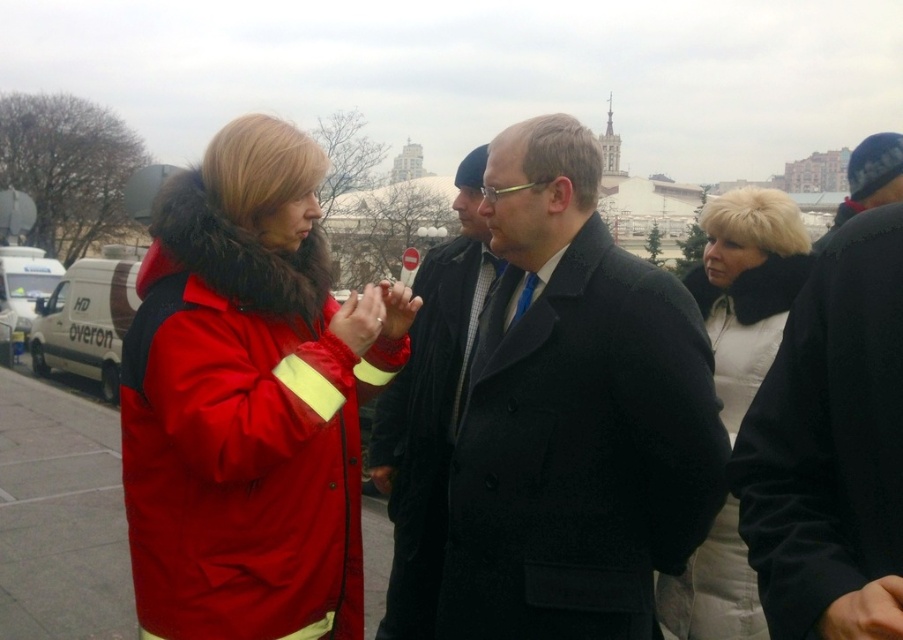
Is the position of matte black coat at center more distant than that of red fabric jacket at left?

No, matte black coat at center is in front of red fabric jacket at left.

How much distance is there between matte black coat at center and red fabric jacket at left?

matte black coat at center and red fabric jacket at left are 40.58 meters apart.

Between point (570, 312) and point (22, 417), which one is positioned behind?

Positioned behind is point (22, 417).

At what (x,y) coordinates should I click in order to perform the action: click on matte black coat at center. Please return your answer as a coordinate pair (x, y). This screenshot has width=903, height=640. Looking at the image, I should click on (574, 413).

Can you confirm if matte black coat at center is positioned to the right of dark gray wool coat at center?

Yes, matte black coat at center is to the right of dark gray wool coat at center.

Is matte black coat at center thinner than dark gray wool coat at center?

No.

This screenshot has width=903, height=640. In order to click on matte black coat at center in this screenshot , I will do `click(574, 413)`.

Does red fabric jacket at left appear over white van at left?

Incorrect, red fabric jacket at left is not positioned above white van at left.

This screenshot has width=903, height=640. Identify the location of red fabric jacket at left. (61, 516).